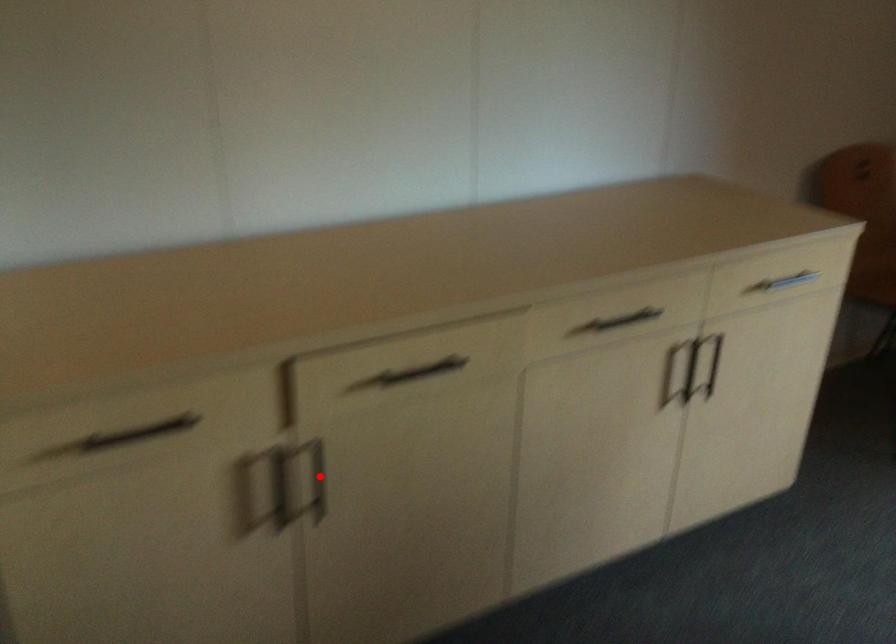
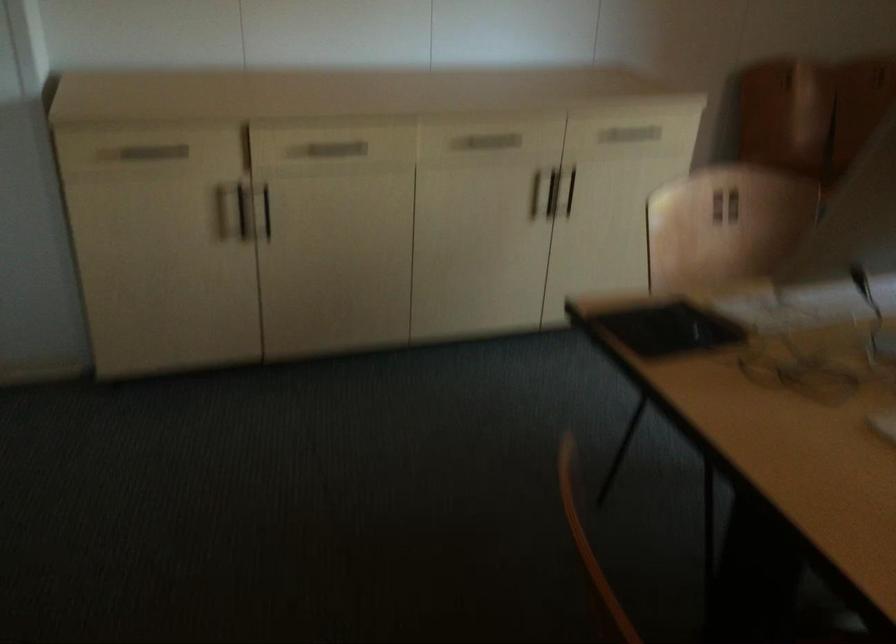
Locate, in the second image, the point that corresponds to the highlighted location in the first image.

(264, 211)